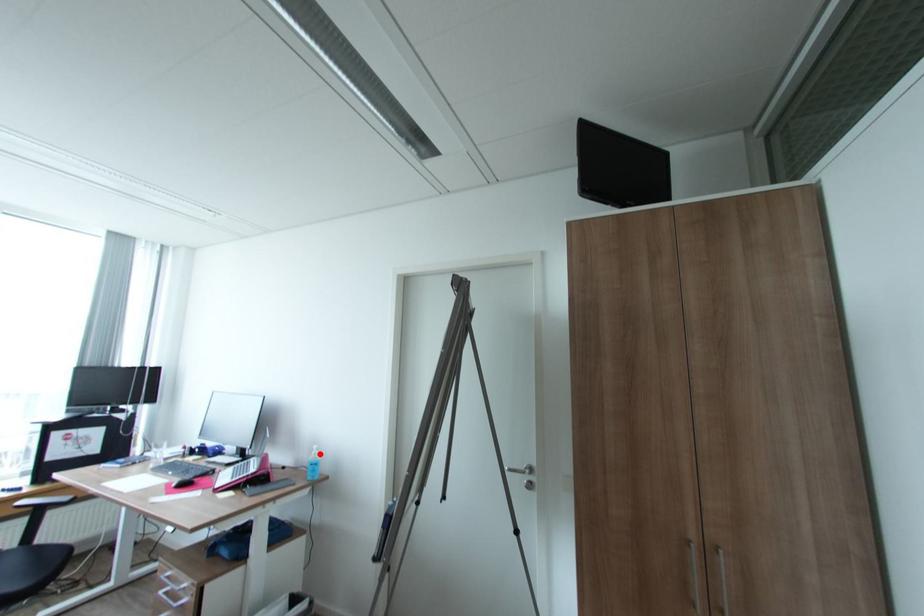
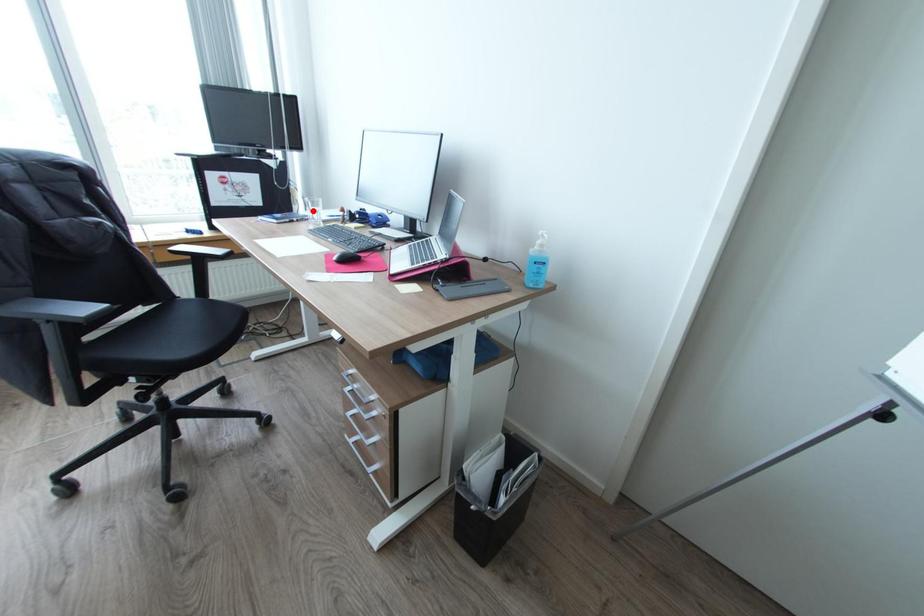
I am providing you with two images of the same scene from different viewpoints. A red point is marked on the first image and another point is marked on the second image. Does the point marked in image1 correspond to the same location as the one in image2?

No